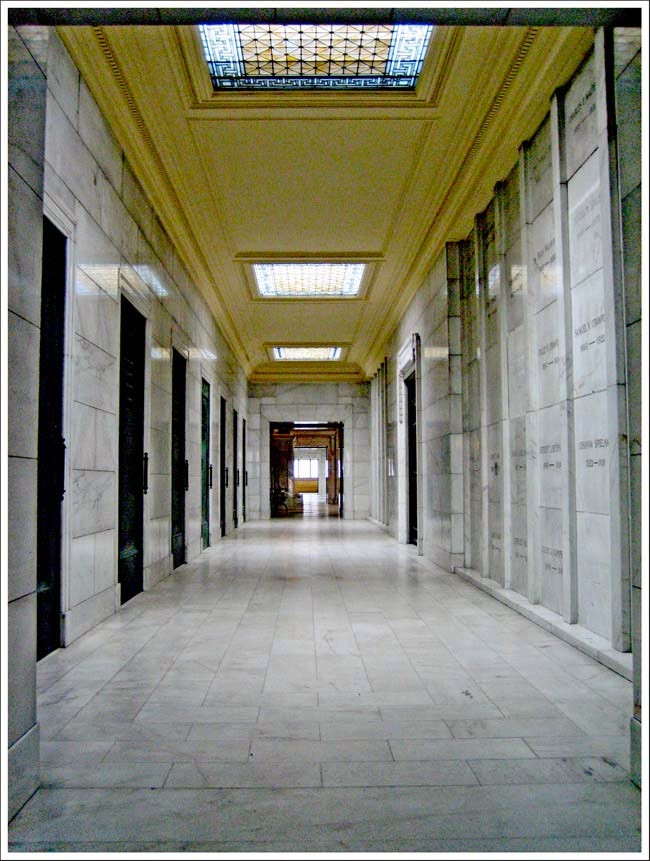
Identify the location of brown doorways. The height and width of the screenshot is (861, 650). (335, 468), (275, 468).